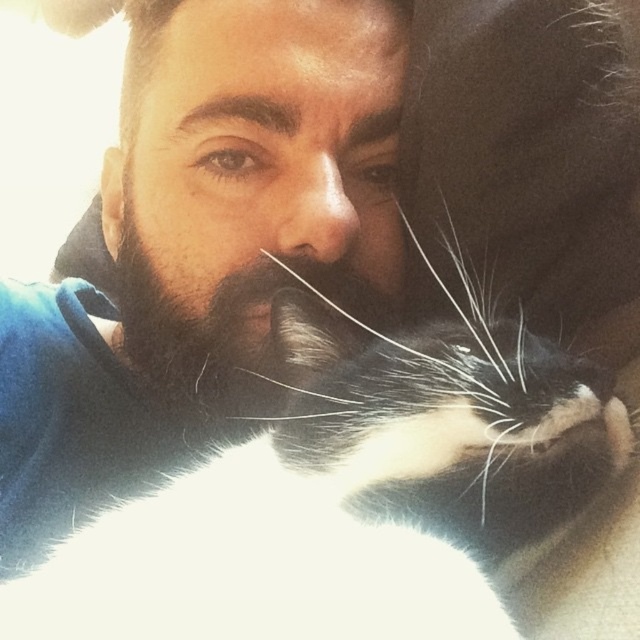
Is white fur cat at center to the right of black fuzzy beard at center from the viewer's perspective?

In fact, white fur cat at center is to the left of black fuzzy beard at center.

Is white fur cat at center to the left of black fuzzy beard at center from the viewer's perspective?

Indeed, white fur cat at center is positioned on the left side of black fuzzy beard at center.

What do you see at coordinates (291, 477) in the screenshot? I see `white fur cat at center` at bounding box center [291, 477].

Find the location of a particular element. white fur cat at center is located at coordinates [x=291, y=477].